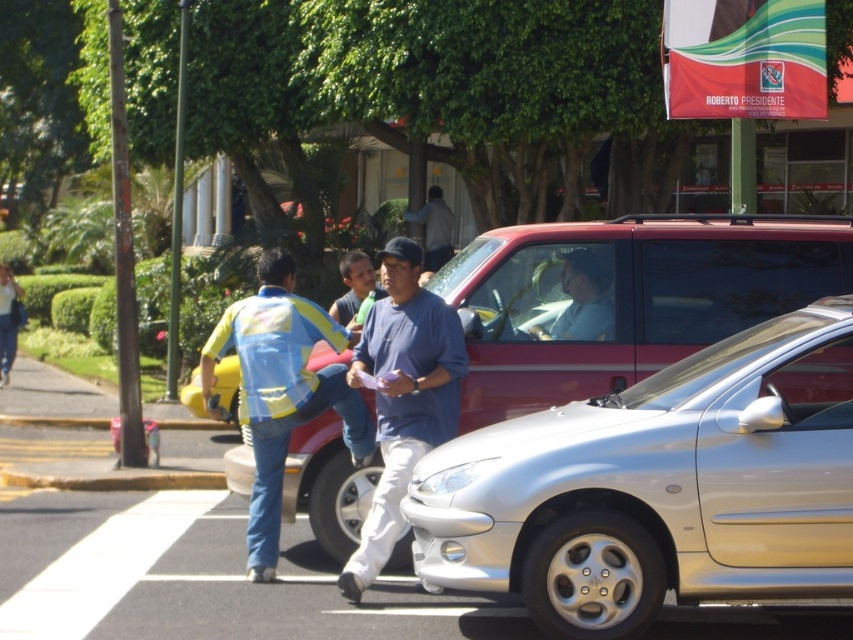
Question: Is yellow reflective vest at center below yellow reflective safety vest at center?

Choices:
 (A) no
 (B) yes

Answer: (B)

Question: Which point is farther to the camera?

Choices:
 (A) (263, 465)
 (B) (241, 300)
 (C) (396, 358)

Answer: (B)

Question: Which point is closer to the camera?

Choices:
 (A) (10, 291)
 (B) (566, 252)
 (C) (448, 230)

Answer: (B)

Question: Based on their relative distances, which object is nearer to the silver metallic car at center?

Choices:
 (A) blue cotton shirt at center
 (B) matte blue shirt at center

Answer: (A)

Question: Is metallic silver sedan at center wider than blue denim jeans at center?

Choices:
 (A) yes
 (B) no

Answer: (A)

Question: Is blue cotton shirt at center bigger than matte blue shirt at center?

Choices:
 (A) no
 (B) yes

Answer: (B)